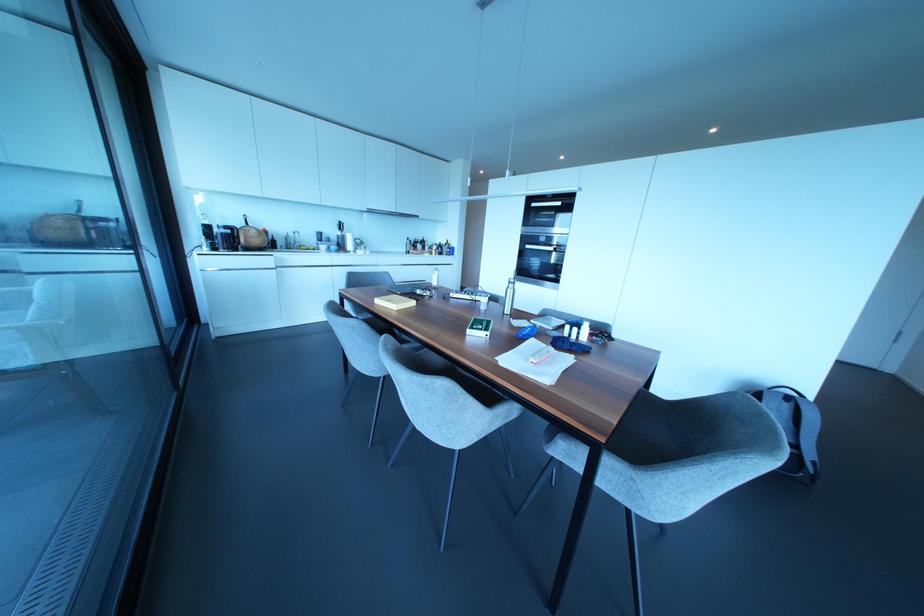
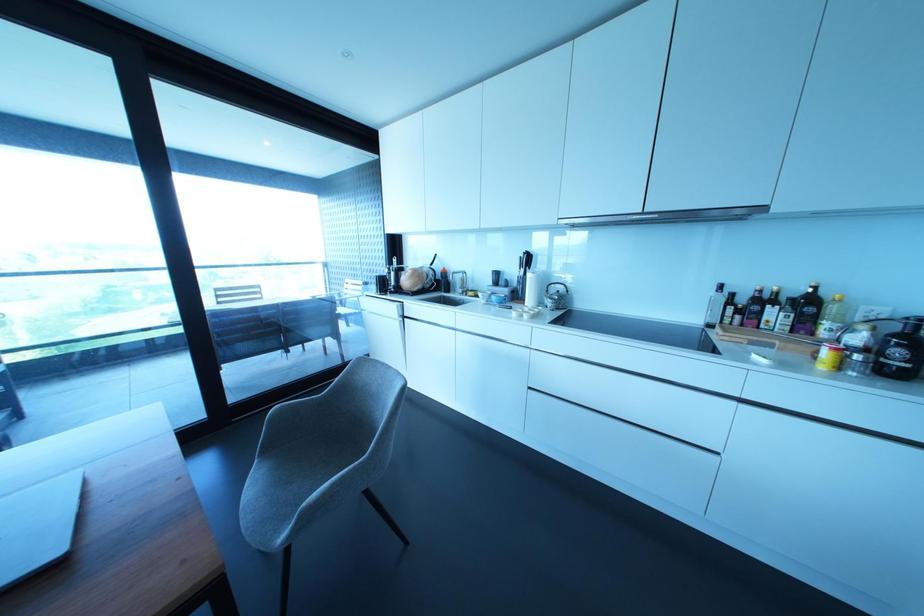
In the second image, find the point that corresponds to [426,246] in the first image.

(825, 323)